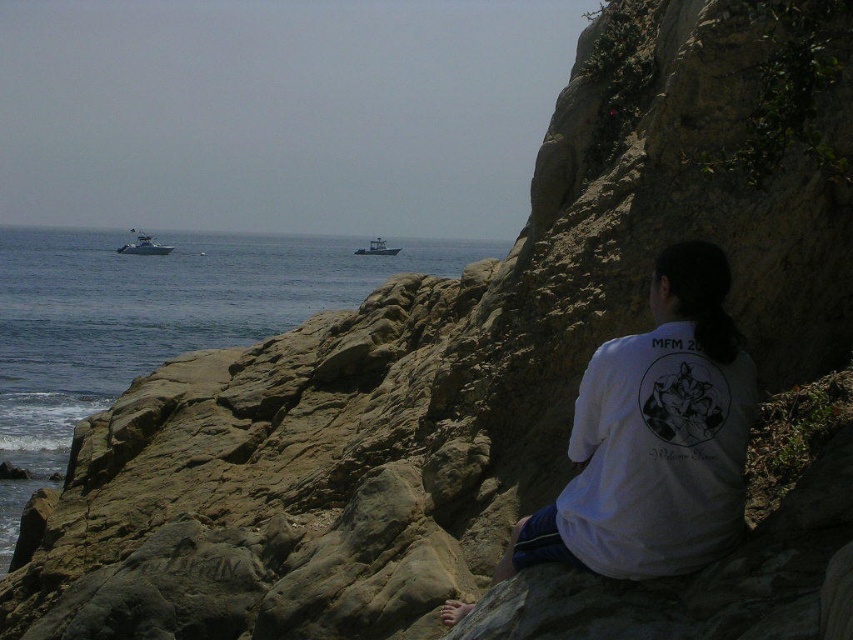
Question: Which object is closer to the camera taking this photo?

Choices:
 (A) blue water at center
 (B) white plastic boat at left

Answer: (A)

Question: Which point appears farthest from the camera in this image?

Choices:
 (A) (125, 269)
 (B) (602, 362)
 (C) (154, 253)
 (D) (387, 248)

Answer: (D)

Question: Is blue water at center in front of white plastic boat at left?

Choices:
 (A) yes
 (B) no

Answer: (A)

Question: Can you confirm if blue water at center is thinner than white cotton shirt at center?

Choices:
 (A) yes
 (B) no

Answer: (B)

Question: Is the position of blue water at center less distant than that of white cotton shirt at center?

Choices:
 (A) yes
 (B) no

Answer: (B)

Question: Which of these objects is positioned closest to the white plastic boat at left?

Choices:
 (A) blue water at center
 (B) white plastic boat at center
 (C) white cotton shirt at center

Answer: (A)